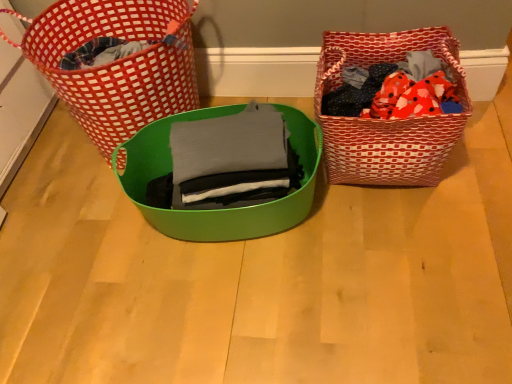
Image resolution: width=512 pixels, height=384 pixels. In order to click on free space on the front side of red woven picnic basket at right, which is the second picnic basket from left to right in this screenshot , I will do `click(404, 245)`.